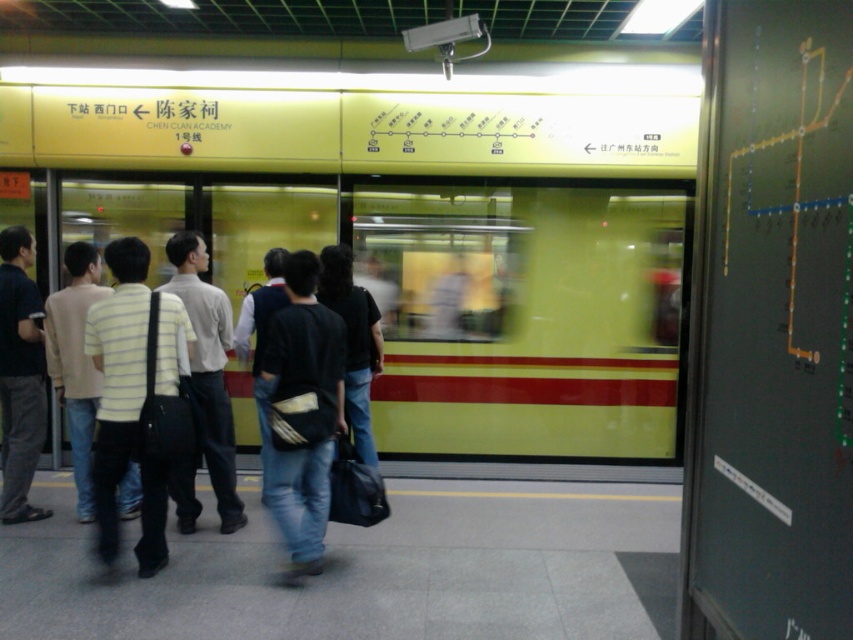
Who is positioned more to the right, yellow matte train at center or dark gray jeans at left?

yellow matte train at center

Does point (477, 424) lie in front of point (27, 397)?

No.

Find the location of a particular element. This screenshot has width=853, height=640. yellow matte train at center is located at coordinates (456, 298).

Is striped cotton shirt at left thinner than striped cotton shirt at center?

No, striped cotton shirt at left is not thinner than striped cotton shirt at center.

Can you confirm if striped cotton shirt at left is shorter than striped cotton shirt at center?

Yes.

Locate an element on the screen. Image resolution: width=853 pixels, height=640 pixels. striped cotton shirt at left is located at coordinates (125, 406).

Between black matte backpack at center and dark gray jeans at left, which one has less height?

black matte backpack at center

Is black matte backpack at center wider than dark gray jeans at left?

Correct, the width of black matte backpack at center exceeds that of dark gray jeans at left.

Is point (325, 433) positioned in front of point (13, 467)?

That is True.

Find the location of a particular element. black matte backpack at center is located at coordinates (300, 394).